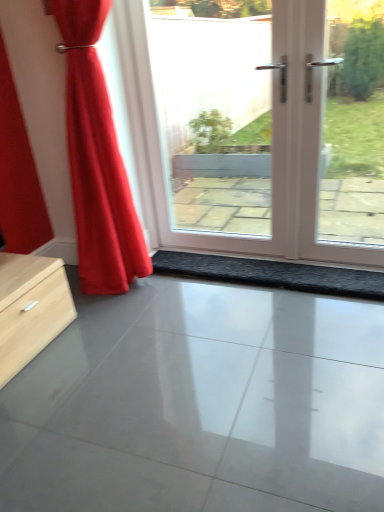
This screenshot has height=512, width=384. Find the location of `black textured mat at center`. black textured mat at center is located at coordinates (272, 274).

Identify the location of white glossy door at center. (273, 143).

This screenshot has width=384, height=512. Identify the location of black textured mat at center. (272, 274).

Is white glossy door at center thinner than glossy concrete floor at center?

Correct, the width of white glossy door at center is less than that of glossy concrete floor at center.

Based on their sizes in the image, would you say white glossy door at center is bigger or smaller than glossy concrete floor at center?

In the image, white glossy door at center appears to be larger than glossy concrete floor at center.

Is white glossy door at center oriented away from glossy concrete floor at center?

No, white glossy door at center is not facing away from glossy concrete floor at center.

Is point (304, 135) closer to camera compared to point (321, 452)?

No, it is not.

Is black textured mat at center surrounding glossy concrete floor at center?

No.

From a real-world perspective, is black textured mat at center over glossy concrete floor at center?

Yes.

I want to click on doormat that is behind the glossy concrete floor at center, so click(272, 274).

Is black textured mat at center positioned with its back to glossy concrete floor at center?

No, glossy concrete floor at center is not at the back of black textured mat at center.

Find the location of `curtain located behind the glossy concrete floor at center`. curtain located behind the glossy concrete floor at center is located at coordinates (97, 159).

Does satin red curtain at left appear on the left side of glossy concrete floor at center?

Yes.

From the image's perspective, which is above, satin red curtain at left or glossy concrete floor at center?

satin red curtain at left.

Between satin red curtain at left and glossy concrete floor at center, which one has smaller size?

Smaller between the two is glossy concrete floor at center.

From the image's perspective, between glossy concrete floor at center and black textured mat at center, who is located below?

glossy concrete floor at center.

Can you confirm if glossy concrete floor at center is bigger than black textured mat at center?

Correct, glossy concrete floor at center is larger in size than black textured mat at center.

What's the angular difference between glossy concrete floor at center and black textured mat at center's facing directions?

The angular difference between glossy concrete floor at center and black textured mat at center is 0.227 degrees.

Considering the points (41, 426) and (294, 277), which point is behind, point (41, 426) or point (294, 277)?

The point (294, 277) is more distant.

Is glossy concrete floor at center not within white glossy door at center?

glossy concrete floor at center lies outside white glossy door at center's area.

Who is more distant, glossy concrete floor at center or white glossy door at center?

white glossy door at center is further from the camera.

Considering the relative sizes of glossy concrete floor at center and white glossy door at center in the image provided, is glossy concrete floor at center bigger than white glossy door at center?

Incorrect, glossy concrete floor at center is not larger than white glossy door at center.

Between point (370, 337) and point (276, 179), which one is positioned in front?

The point (370, 337) is closer.

Looking at this image, can you tell me how much glossy concrete floor at center and satin red curtain at left differ in facing direction?

The angle between the facing direction of glossy concrete floor at center and the facing direction of satin red curtain at left is 2.08 degrees.

Which is more to the right, glossy concrete floor at center or satin red curtain at left?

glossy concrete floor at center.

Can you confirm if glossy concrete floor at center is wider than satin red curtain at left?

Indeed, glossy concrete floor at center has a greater width compared to satin red curtain at left.

Between glossy concrete floor at center and satin red curtain at left, which one is positioned behind?

satin red curtain at left is further away from the camera.

Where is `door on the right of black textured mat at center`? door on the right of black textured mat at center is located at coordinates (273, 143).

Which is more to the right, white glossy door at center or black textured mat at center?

From the viewer's perspective, white glossy door at center appears more on the right side.

Is there a large distance between white glossy door at center and black textured mat at center?

No, white glossy door at center is in close proximity to black textured mat at center.

From a real-world perspective, which object rests below the other?

From a 3D spatial view, black textured mat at center is below.

Locate an element on the screen. The height and width of the screenshot is (512, 384). door on the right of the glossy concrete floor at center is located at coordinates click(x=273, y=143).

The height and width of the screenshot is (512, 384). In the image, there is a black textured mat at center. In order to click on concrete below it (from a real-world perspective) in this screenshot , I will do `click(200, 404)`.

Looking at this image, considering their positions, is satin red curtain at left positioned closer to black textured mat at center than glossy concrete floor at center?

satin red curtain at left is closer to black textured mat at center.

Considering their positions, is black textured mat at center positioned further to white glossy door at center than glossy concrete floor at center?

glossy concrete floor at center lies further to white glossy door at center than the other object.

Based on the photo, which object lies nearer to the anchor point white glossy door at center, satin red curtain at left or glossy concrete floor at center?

Among the two, satin red curtain at left is located nearer to white glossy door at center.

When comparing their distances from glossy concrete floor at center, does satin red curtain at left or black textured mat at center seem closer?

black textured mat at center is closer to glossy concrete floor at center.

Estimate the real-world distances between objects in this image. Which object is closer to glossy concrete floor at center, black textured mat at center or satin red curtain at left?

black textured mat at center.

Based on their spatial positions, is glossy concrete floor at center or white glossy door at center closer to black textured mat at center?

white glossy door at center lies closer to black textured mat at center than the other object.

Estimate the real-world distances between objects in this image. Which object is further from white glossy door at center, glossy concrete floor at center or black textured mat at center?

glossy concrete floor at center lies further to white glossy door at center than the other object.

From the picture: Considering their positions, is satin red curtain at left positioned further to glossy concrete floor at center than white glossy door at center?

white glossy door at center is further to glossy concrete floor at center.

This screenshot has width=384, height=512. What are the coordinates of `curtain located between glossy concrete floor at center and black textured mat at center in the depth direction` in the screenshot? It's located at (97, 159).

In order to click on door between glossy concrete floor at center and black textured mat at center in the front-back direction in this screenshot , I will do [x=273, y=143].

Image resolution: width=384 pixels, height=512 pixels. What are the coordinates of `curtain between white glossy door at center and glossy concrete floor at center vertically` in the screenshot? It's located at (97, 159).

At what (x,y) coordinates should I click in order to perform the action: click on doormat between satin red curtain at left and white glossy door at center. Please return your answer as a coordinate pair (x, y). Image resolution: width=384 pixels, height=512 pixels. Looking at the image, I should click on (272, 274).